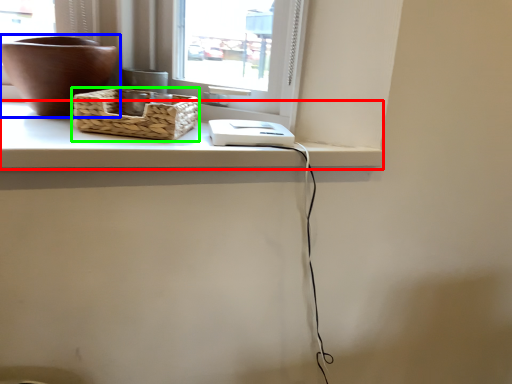
Question: Which is farther away from counter top (highlighted by a red box)? flowerpot (highlighted by a blue box) or picnic basket (highlighted by a green box)?

Choices:
 (A) flowerpot
 (B) picnic basket

Answer: (A)